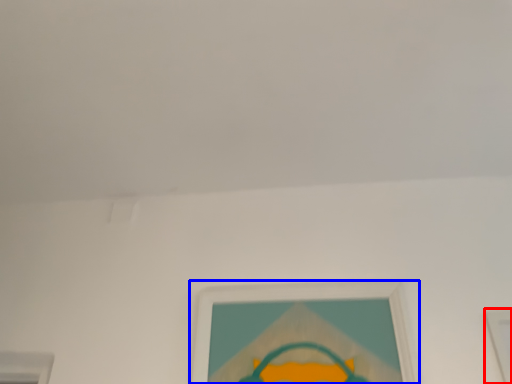
Question: Among these objects, which one is nearest to the camera, picture frame (highlighted by a red box) or picture frame (highlighted by a blue box)?

Choices:
 (A) picture frame
 (B) picture frame

Answer: (A)